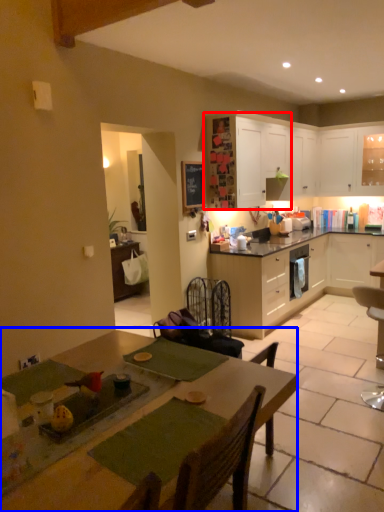
Question: Which point is further to the camera, cabinetry (highlighted by a red box) or table (highlighted by a blue box)?

Choices:
 (A) cabinetry
 (B) table

Answer: (A)